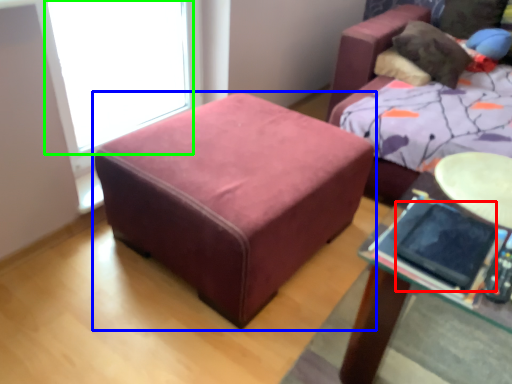
Question: Considering the real-world distances, which object is farthest from ipad (highlighted by a red box)? table (highlighted by a blue box) or window screen (highlighted by a green box)?

Choices:
 (A) table
 (B) window screen

Answer: (B)